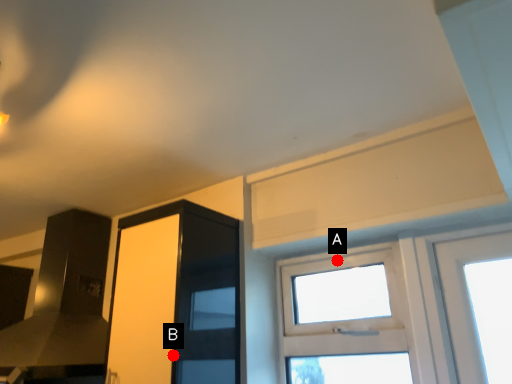
Question: Two points are circled on the image, labeled by A and B beside each circle. Among these points, which one is farthest from the camera?

Choices:
 (A) A is further
 (B) B is further

Answer: (A)